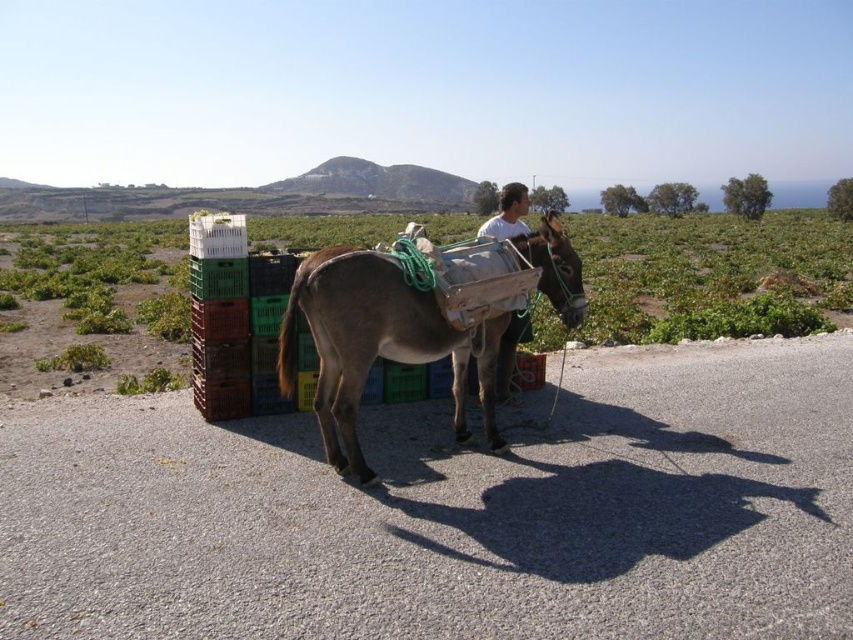
From the picture: You are a delivery person who needs to place a package on the green plastic crates at center. What are the coordinates where you should place the package?

The coordinates for the green plastic crates at center are at point (712, 275).

You are a farmer standing on the road and want to check the load on the donkey. Which object should you approach first, the brown textured donkey at center or the light brown leather pants at center?

You should approach the brown textured donkey at center first because it is closer to you than the light brown leather pants at center.

You are a farmer who needs to secure a new saddle on the brown textured donkey at center. The light brown leather pants at center are in your way. Which object should you move first to access the donkey?

You should move the light brown leather pants at center first because the brown textured donkey at center is to the left of light brown leather pants at center, meaning the pants are blocking the path to the donkey.